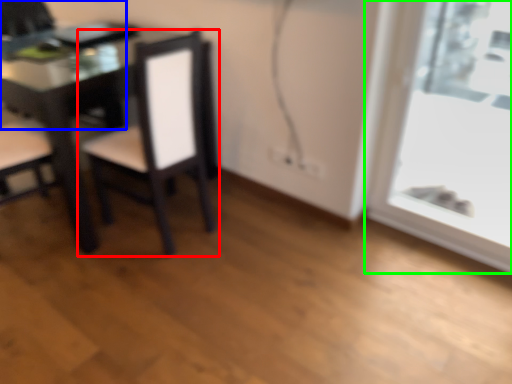
Question: Which object is the closest to the chair (highlighted by a red box)? Choose among these: chair (highlighted by a blue box) or window (highlighted by a green box).

Choices:
 (A) chair
 (B) window

Answer: (A)